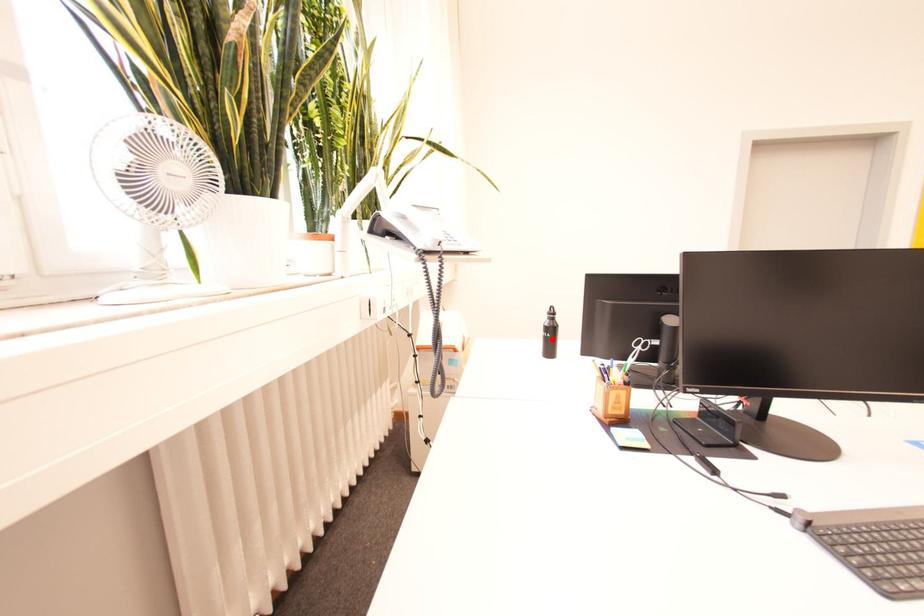
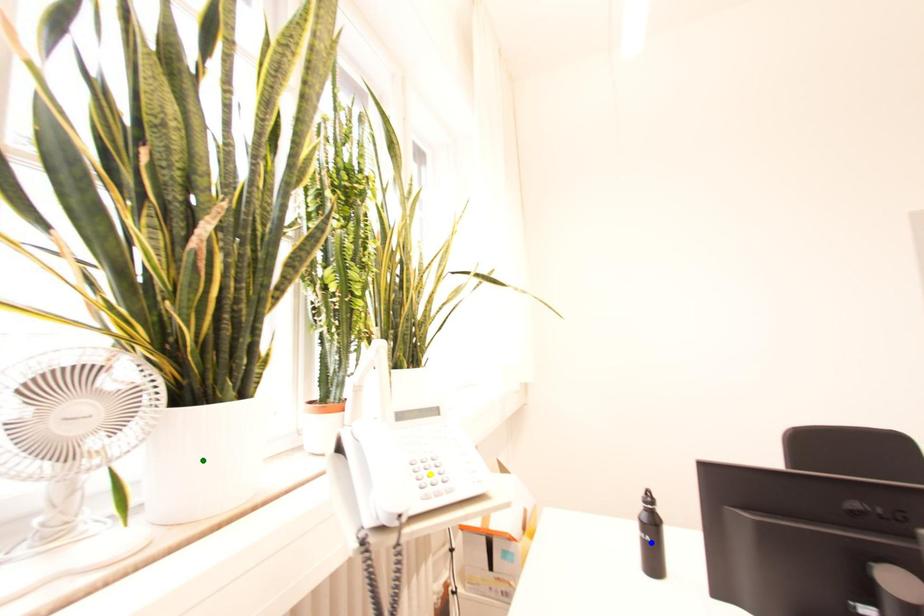
Question: I am providing you with two images of the same scene from different viewpoints. A red point is marked on the first image. You are given multiple points on the second image. Which mark in image 2 goes with the point in image 1?

Choices:
 (A) green point
 (B) blue point
 (C) yellow point

Answer: (B)